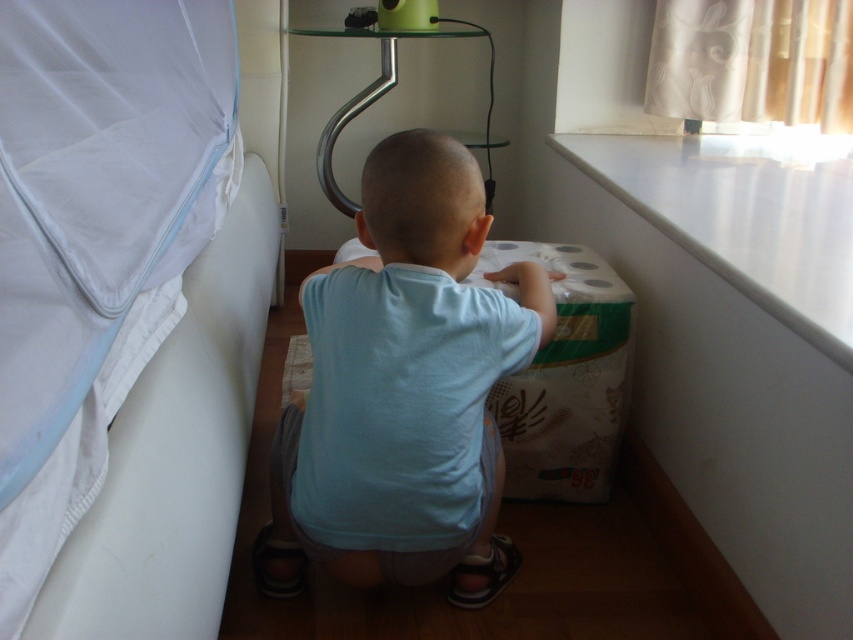
Between white fabric bed at left and light blue cotton shirt at center, which one has less height?

light blue cotton shirt at center

Is white fabric bed at left above light blue cotton shirt at center?

Yes.

Find the location of `white fabric bed at left`. white fabric bed at left is located at coordinates (96, 236).

Is white fabric bed at left positioned before white smooth ledge at upper right?

Yes.

Can you confirm if white fabric bed at left is positioned below white smooth ledge at upper right?

Incorrect, white fabric bed at left is not positioned below white smooth ledge at upper right.

Is point (19, 230) farther from camera compared to point (796, 268)?

No, (19, 230) is in front of (796, 268).

Find the location of `white fabric bed at left`. white fabric bed at left is located at coordinates (96, 236).

Who is lower down, light blue cotton shirt at center or white smooth ledge at upper right?

light blue cotton shirt at center is below.

Is point (476, 253) less distant than point (807, 310)?

That is False.

Identify the location of light blue cotton shirt at center. The height and width of the screenshot is (640, 853). (404, 388).